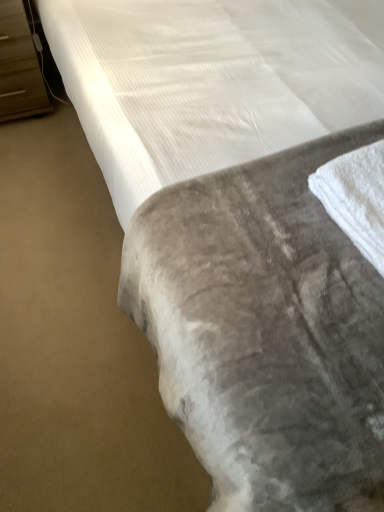
What do you see at coordinates (356, 198) in the screenshot?
I see `white soft towel at lower right` at bounding box center [356, 198].

Measure the distance between white soft towel at lower right and camera.

A distance of 85.10 centimeters exists between white soft towel at lower right and camera.

Measure the distance between point (341, 202) and camera.

Point (341, 202) and camera are 35.79 inches apart from each other.

Where is `white soft towel at lower right`? This screenshot has height=512, width=384. white soft towel at lower right is located at coordinates (356, 198).

Measure the distance between point (15, 19) and camera.

1.49 meters.

What do you see at coordinates (19, 66) in the screenshot?
I see `brown wood dresser at left` at bounding box center [19, 66].

In order to face brown wood dresser at left, should I rotate leftwards or rightwards?

It's best to rotate left around 24.254 degrees.

Find the location of a particular element. brown wood dresser at left is located at coordinates (19, 66).

Locate an element on the screen. This screenshot has height=512, width=384. white soft towel at lower right is located at coordinates (356, 198).

From the picture: Based on their positions, is white soft towel at lower right located to the left or right of brown wood dresser at left?

Clearly, white soft towel at lower right is on the right of brown wood dresser at left in the image.

Based on the photo, which is in front, white soft towel at lower right or brown wood dresser at left?

Positioned in front is white soft towel at lower right.

Does point (380, 144) lie in front of point (14, 33)?

That is True.

From the image's perspective, which is below, white soft towel at lower right or brown wood dresser at left?

white soft towel at lower right is shown below in the image.

From a real-world perspective, between white soft towel at lower right and brown wood dresser at left, who is vertically higher?

From a 3D spatial view, white soft towel at lower right is above.

Considering the sizes of objects white soft towel at lower right and brown wood dresser at left in the image provided, who is thinner, white soft towel at lower right or brown wood dresser at left?

Thinner between the two is white soft towel at lower right.

In the scene shown: Who is shorter, white soft towel at lower right or brown wood dresser at left?

With less height is white soft towel at lower right.

Is white soft towel at lower right smaller than brown wood dresser at left?

Indeed, white soft towel at lower right has a smaller size compared to brown wood dresser at left.

Would you say white soft towel at lower right contains brown wood dresser at left?

No, brown wood dresser at left is not inside white soft towel at lower right.

In the scene shown: Is white soft towel at lower right next to brown wood dresser at left and touching it?

No, white soft towel at lower right is not touching brown wood dresser at left.

Is white soft towel at lower right oriented away from brown wood dresser at left?

Yes, brown wood dresser at left is at the back of white soft towel at lower right.

Identify the location of bath towel that appears in front of the brown wood dresser at left. The width and height of the screenshot is (384, 512). (356, 198).

Considering the relative positions of brown wood dresser at left and white soft towel at lower right in the image provided, is brown wood dresser at left to the left of white soft towel at lower right from the viewer's perspective?

Yes, brown wood dresser at left is to the left of white soft towel at lower right.

In the scene shown: Which object is closer to the camera taking this photo, brown wood dresser at left or white soft towel at lower right?

Positioned in front is white soft towel at lower right.

Does point (21, 61) appear closer or farther from the camera than point (367, 221)?

Clearly, point (21, 61) is more distant from the camera than point (367, 221).

From the image's perspective, would you say brown wood dresser at left is shown under white soft towel at lower right?

No, from the image's perspective, brown wood dresser at left is not beneath white soft towel at lower right.

From a real-world perspective, which is physically below, brown wood dresser at left or white soft towel at lower right?

brown wood dresser at left is physically lower.

Between brown wood dresser at left and white soft towel at lower right, which one has smaller width?

white soft towel at lower right.

Can you confirm if brown wood dresser at left is taller than white soft towel at lower right?

Indeed, brown wood dresser at left has a greater height compared to white soft towel at lower right.

Considering the relative sizes of brown wood dresser at left and white soft towel at lower right in the image provided, is brown wood dresser at left bigger than white soft towel at lower right?

Indeed, brown wood dresser at left has a larger size compared to white soft towel at lower right.

Can we say brown wood dresser at left lies outside white soft towel at lower right?

Yes, brown wood dresser at left is not within white soft towel at lower right.

Is there a large distance between brown wood dresser at left and white soft towel at lower right?

brown wood dresser at left is positioned a significant distance from white soft towel at lower right.

Is brown wood dresser at left oriented towards white soft towel at lower right?

No.

The image size is (384, 512). In order to click on bath towel below the brown wood dresser at left (from the image's perspective) in this screenshot , I will do `click(356, 198)`.

You are a GUI agent. You are given a task and a screenshot of the screen. Output one action in this format:
    pyautogui.click(x=<x>, y=<y>)
    Task: Click on the bath towel below the brown wood dresser at left (from the image's perspective)
    Image resolution: width=384 pixels, height=512 pixels.
    Given the screenshot: What is the action you would take?
    pyautogui.click(x=356, y=198)

Where is `dresser that is on the left side of white soft towel at lower right`? This screenshot has width=384, height=512. dresser that is on the left side of white soft towel at lower right is located at coordinates (19, 66).